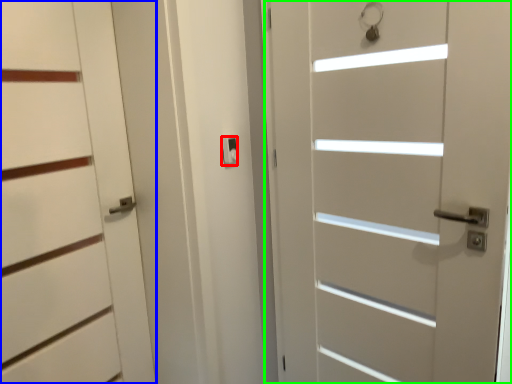
Question: Based on their relative distances, which object is nearer to latch (highlighted by a red box)? Choose from door (highlighted by a blue box) and door (highlighted by a green box).

Choices:
 (A) door
 (B) door

Answer: (A)